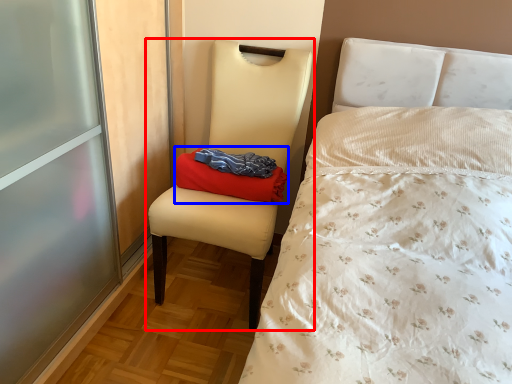
Question: Which of the following is the farthest to the observer, chair (highlighted by a red box) or pillow (highlighted by a blue box)?

Choices:
 (A) chair
 (B) pillow

Answer: (B)